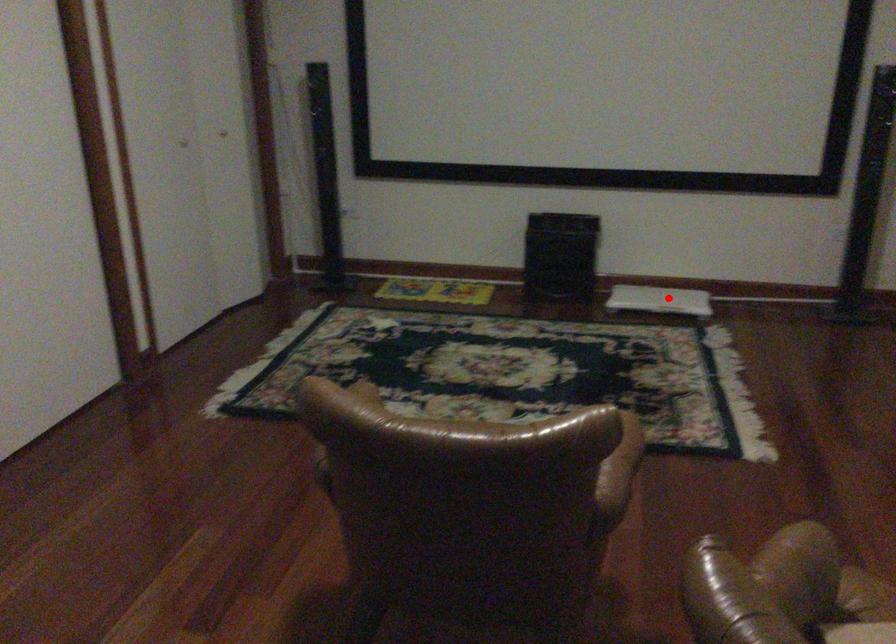
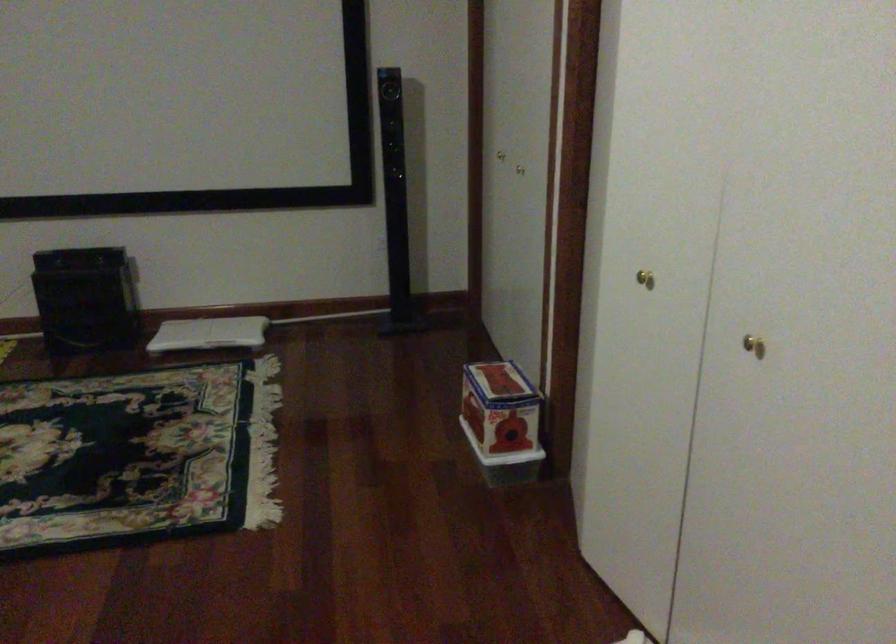
Question: I am providing you with two images of the same scene from different viewpoints. In image1, a red point is highlighted. Considering the same 3D point in image2, which of the following is correct?

Choices:
 (A) It is closer
 (B) It is farther

Answer: (A)